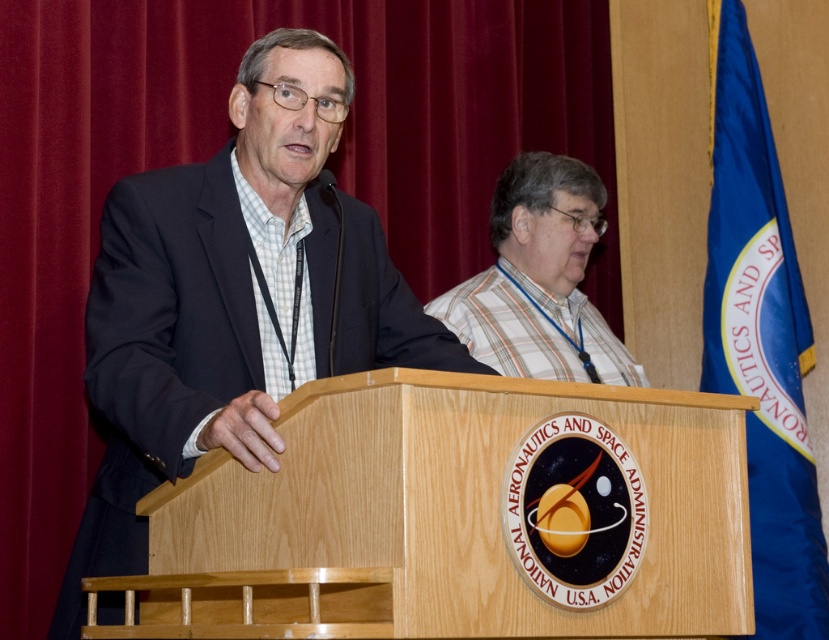
Does point (51, 49) come farther from viewer compared to point (507, 356)?

No, (51, 49) is in front of (507, 356).

Is velvet red curtain at upper left taller than plaid fabric shirt at center?

Indeed, velvet red curtain at upper left has a greater height compared to plaid fabric shirt at center.

Based on the photo, who is more distant from viewer, (142, 145) or (545, 339)?

The point (545, 339) is behind.

Where is `velvet red curtain at upper left`? Image resolution: width=829 pixels, height=640 pixels. velvet red curtain at upper left is located at coordinates (217, 148).

Consider the image. Who is taller, velvet red curtain at upper left or light brown wood podium at center?

With more height is velvet red curtain at upper left.

Who is higher up, velvet red curtain at upper left or light brown wood podium at center?

velvet red curtain at upper left is higher up.

At what (x,y) coordinates should I click in order to perform the action: click on velvet red curtain at upper left. Please return your answer as a coordinate pair (x, y). This screenshot has height=640, width=829. Looking at the image, I should click on (217, 148).

Which is below, light brown wood podium at center or plaid fabric shirt at center?

Positioned lower is light brown wood podium at center.

Where is `light brown wood podium at center`? light brown wood podium at center is located at coordinates (449, 516).